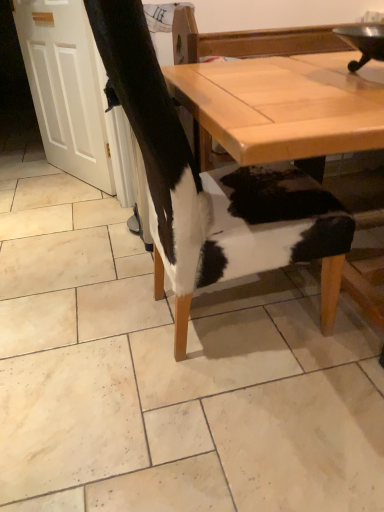
Locate an element on the screen. Image resolution: width=384 pixels, height=512 pixels. free space that is to the left of cowhide chair at center is located at coordinates (74, 323).